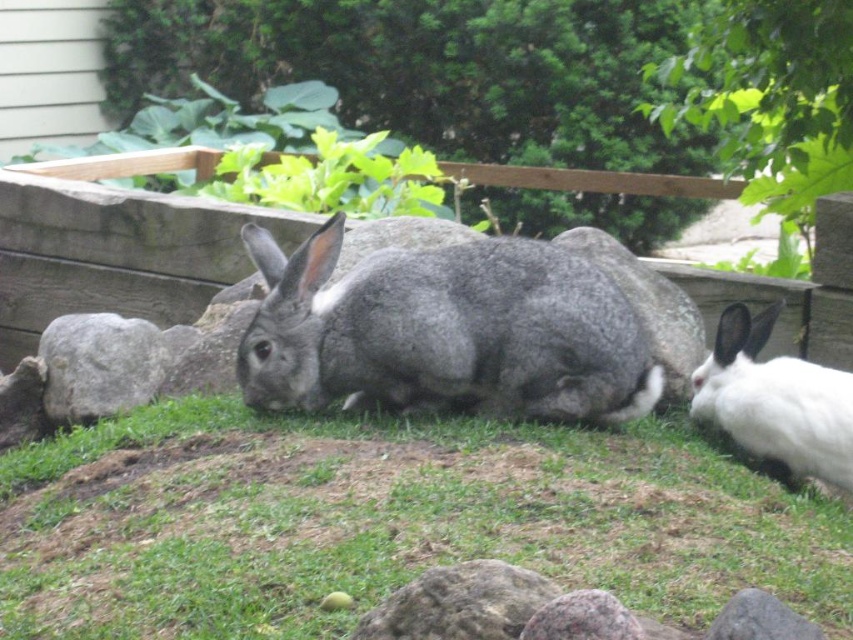
You are a gardener who wants to place a small flower pot between the white fluffy rabbit at right and the gray rough stone at lower left. Based on their positions, where should you place the flower pot so it is equidistant from both objects?

The white fluffy rabbit at right is positioned under the gray rough stone at lower left, so placing the flower pot directly between them would require positioning it beneath the gray rough stone at lower left, equidistant from both the rabbit and the stone.

You are standing in the garden where the two rabbits are located. You want to place a small treat exactly at the position marked by the point (775,401). Which rabbit will be closest to this treat?

The point (775,401) marks the white fluffy rabbit at right, so the white fluffy rabbit at right will be closest to the treat placed there.